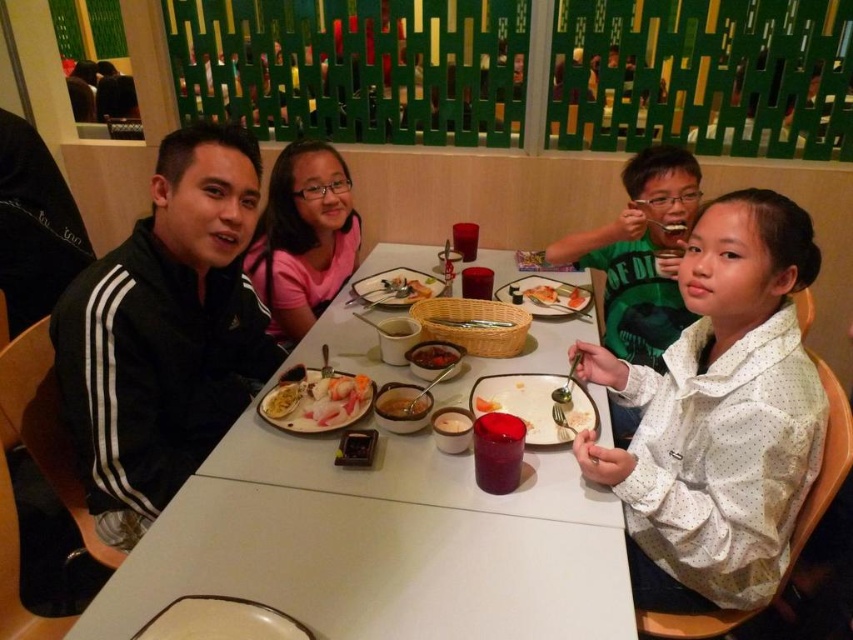
Question: Which of the following is the farthest from the observer?

Choices:
 (A) slightly browned rice at upper center
 (B) white dotted shirt at lower right
 (C) slightly translucent white fish at center

Answer: (A)

Question: Where is slightly translucent white rice at center located in relation to orange matte sushi at center in the image?

Choices:
 (A) right
 (B) left

Answer: (B)

Question: Is the position of smooth brown rice at center less distant than that of smooth white rice at center?

Choices:
 (A) yes
 (B) no

Answer: (B)

Question: Is white dotted shirt at lower right to the left of slightly translucent white fish at center from the viewer's perspective?

Choices:
 (A) no
 (B) yes

Answer: (A)

Question: Which point is closer to the camera?

Choices:
 (A) slightly glossy dark red sauce at center
 (B) smooth white rice at center
 (C) slightly translucent white fish at center

Answer: (B)

Question: Among these points, which one is nearest to the camera?

Choices:
 (A) (427, 364)
 (B) (180, 497)
 (C) (457, 428)
 (D) (285, 401)

Answer: (B)